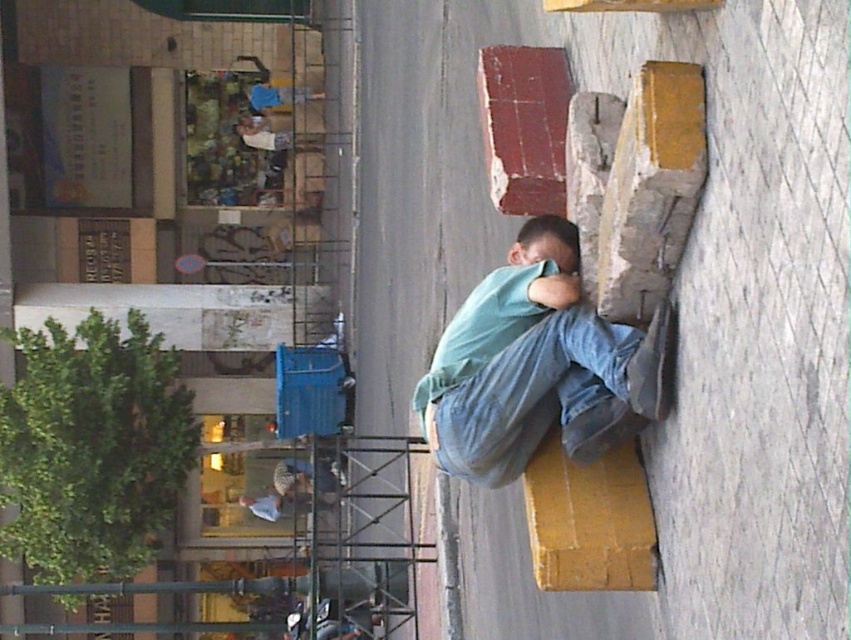
Question: Does denim at right appear over light blue denim pants at lower center?

Choices:
 (A) yes
 (B) no

Answer: (A)

Question: Which object appears farthest from the camera in this image?

Choices:
 (A) light blue denim pants at lower center
 (B) denim at right

Answer: (A)

Question: Does denim at right have a larger size compared to light blue denim pants at lower center?

Choices:
 (A) yes
 (B) no

Answer: (B)

Question: Does denim at right appear on the left side of light blue denim pants at lower center?

Choices:
 (A) no
 (B) yes

Answer: (A)